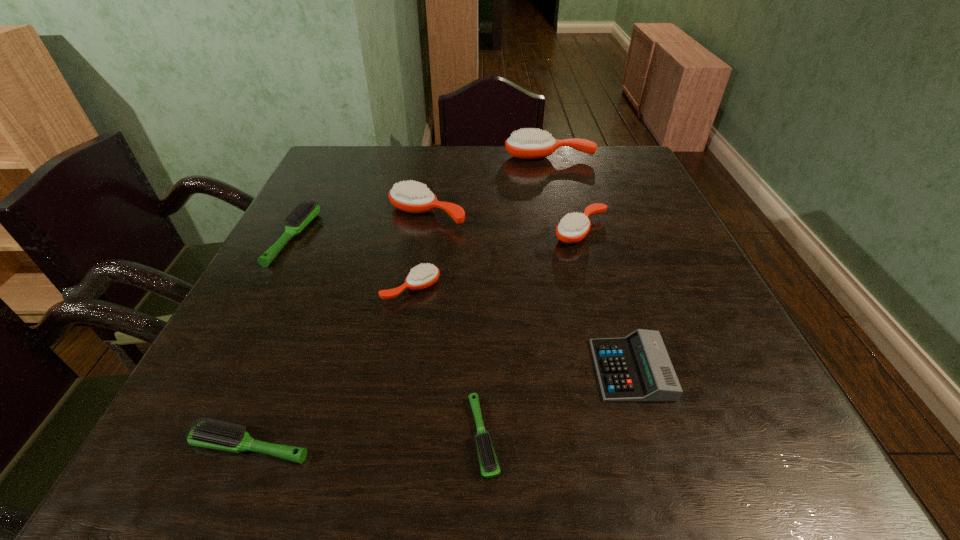
Find the location of a particular element. This screenshot has height=540, width=960. vacant area between the farthest hairbrush and the fifth farthest object is located at coordinates (480, 222).

Locate an element on the screen. free area in between the second biggest light hairbrush and the fifth shortest hairbrush is located at coordinates (416, 338).

Locate an element on the screen. The width and height of the screenshot is (960, 540). empty location between the farthest light hairbrush and the rightmost light hairbrush is located at coordinates (389, 336).

Identify the location of the fourth closest object to the second shortest hairbrush. (637, 368).

Locate an element on the screen. the fourth closest object relative to the fifth shortest hairbrush is located at coordinates (637, 368).

Where is `hairbrush identified as the closest to the gray calculator`? hairbrush identified as the closest to the gray calculator is located at coordinates (490, 468).

The height and width of the screenshot is (540, 960). Identify the location of hairbrush object that ranks as the sixth closest to the biggest light hairbrush. (572, 228).

Locate which orange hairbrush is the second closest to the calculator. Please provide its 2D coordinates. Your answer should be formatted as a tuple, i.e. [(x, y)], where the tuple contains the x and y coordinates of a point satisfying the conditions above.

[(423, 276)]

Locate which orange hairbrush ranks second in proximity to the second shortest hairbrush. Please provide its 2D coordinates. Your answer should be formatted as a tuple, i.e. [(x, y)], where the tuple contains the x and y coordinates of a point satisfying the conditions above.

[(410, 196)]

Point out which light hairbrush is positioned as the second nearest to the fifth object from left to right. Please provide its 2D coordinates. Your answer should be formatted as a tuple, i.e. [(x, y)], where the tuple contains the x and y coordinates of a point satisfying the conditions above.

[(305, 212)]